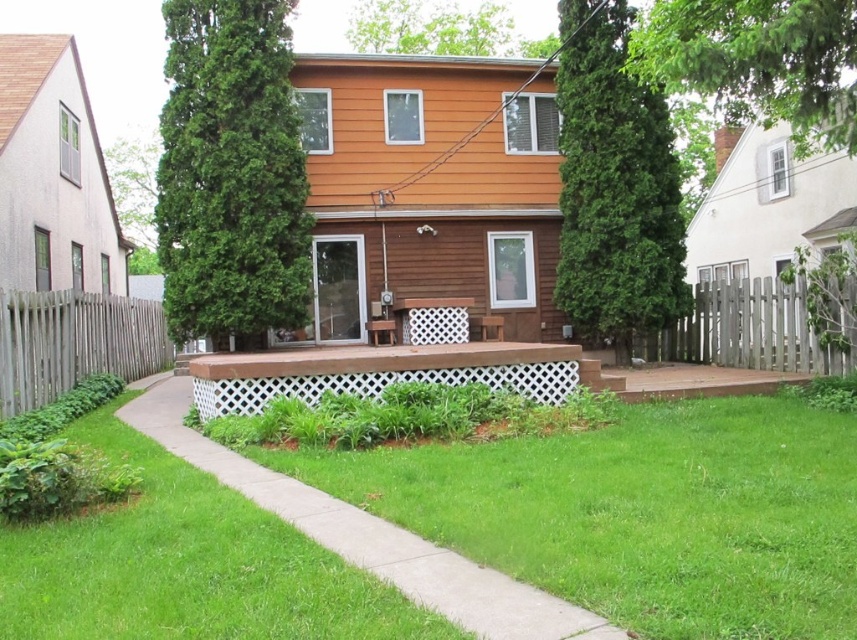
Which is behind, point (500, 630) or point (782, 326)?

The point (782, 326) is behind.

Describe the element at coordinates (367, 534) in the screenshot. I see `concrete at center` at that location.

What are the coordinates of `concrete at center` in the screenshot? It's located at (367, 534).

Where is `concrete at center`? The height and width of the screenshot is (640, 857). concrete at center is located at coordinates (367, 534).

In the scene shown: Is concrete at center to the left of gray wood fence at left from the viewer's perspective?

In fact, concrete at center is to the right of gray wood fence at left.

The width and height of the screenshot is (857, 640). What are the coordinates of `concrete at center` in the screenshot? It's located at (367, 534).

The height and width of the screenshot is (640, 857). I want to click on concrete at center, so click(367, 534).

Who is taller, wooden picket fence at right or gray wood fence at left?

gray wood fence at left

Locate an element on the screen. wooden picket fence at right is located at coordinates tap(765, 324).

Who is more forward, [783,337] or [111,371]?

Point [783,337]

Locate an element on the screen. The height and width of the screenshot is (640, 857). wooden picket fence at right is located at coordinates (765, 324).